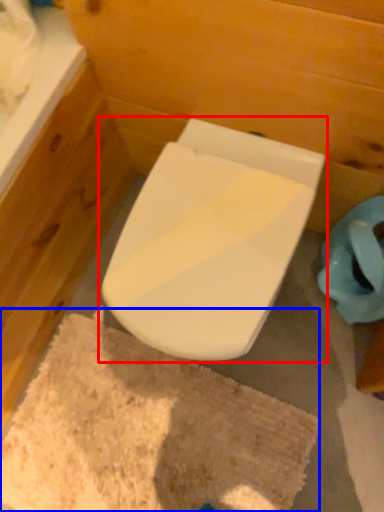
Question: Which of the following is the closest to the observer, toilet (highlighted by a red box) or bath mat (highlighted by a blue box)?

Choices:
 (A) toilet
 (B) bath mat

Answer: (A)